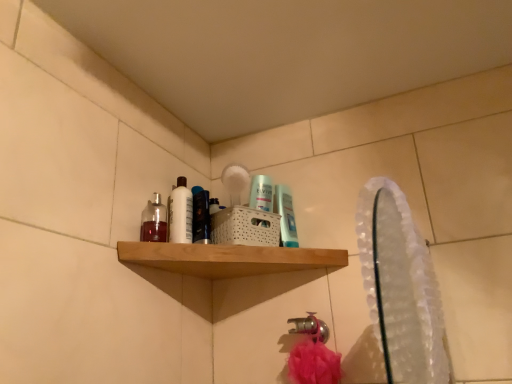
Question: Should I look upward or downward to see white glossy bottle at upper left?

Choices:
 (A) up
 (B) down

Answer: (B)

Question: Is translucent glass bottle at upper left, which ranks as the 1th mouthwash in left-to-right order, completely or partially outside of translucent plastic mouthwash at center, which ranks as the 2th mouthwash in left-to-right order?

Choices:
 (A) no
 (B) yes

Answer: (B)

Question: Is translucent glass bottle at upper left, which ranks as the 1th mouthwash in left-to-right order, next to translucent plastic mouthwash at center, which ranks as the 2th mouthwash in left-to-right order?

Choices:
 (A) no
 (B) yes

Answer: (A)

Question: Considering the relative positions of translucent glass bottle at upper left, which is the third mouthwash in right-to-left order, and translucent plastic mouthwash at center, which ranks as the 2th mouthwash in left-to-right order, in the image provided, is translucent glass bottle at upper left, which is the third mouthwash in right-to-left order, to the right of translucent plastic mouthwash at center, which ranks as the 2th mouthwash in left-to-right order, from the viewer's perspective?

Choices:
 (A) yes
 (B) no

Answer: (B)

Question: Considering the relative sizes of translucent glass bottle at upper left, which ranks as the 1th mouthwash in left-to-right order, and translucent plastic mouthwash at center, the 2th mouthwash positioned from the right, in the image provided, is translucent glass bottle at upper left, which ranks as the 1th mouthwash in left-to-right order, taller than translucent plastic mouthwash at center, the 2th mouthwash positioned from the right,?

Choices:
 (A) no
 (B) yes

Answer: (A)

Question: Could translucent plastic mouthwash at center, which ranks as the 2th mouthwash in left-to-right order, be considered to be inside translucent glass bottle at upper left, which is the third mouthwash in right-to-left order?

Choices:
 (A) yes
 (B) no

Answer: (B)

Question: Is the position of translucent glass bottle at upper left, which ranks as the 1th mouthwash in left-to-right order, less distant than that of translucent plastic mouthwash at center, which ranks as the 2th mouthwash in left-to-right order?

Choices:
 (A) yes
 (B) no

Answer: (A)

Question: Does clear plastic mirror at upper right have a larger size compared to translucent plastic mouthwash at upper center, acting as the first mouthwash starting from the right?

Choices:
 (A) no
 (B) yes

Answer: (B)

Question: From the image's perspective, does clear plastic mirror at upper right appear lower than translucent plastic mouthwash at upper center, which ranks as the 3th mouthwash in left-to-right order?

Choices:
 (A) no
 (B) yes

Answer: (B)

Question: Would you say clear plastic mirror at upper right is a long distance from translucent plastic mouthwash at upper center, acting as the first mouthwash starting from the right?

Choices:
 (A) no
 (B) yes

Answer: (A)

Question: Is clear plastic mirror at upper right positioned with its back to translucent plastic mouthwash at upper center, which ranks as the 3th mouthwash in left-to-right order?

Choices:
 (A) no
 (B) yes

Answer: (A)

Question: Is clear plastic mirror at upper right positioned beyond the bounds of translucent plastic mouthwash at upper center, acting as the first mouthwash starting from the right?

Choices:
 (A) yes
 (B) no

Answer: (A)

Question: Considering the relative positions of clear plastic mirror at upper right and translucent plastic mouthwash at upper center, which ranks as the 3th mouthwash in left-to-right order, in the image provided, is clear plastic mirror at upper right to the right of translucent plastic mouthwash at upper center, which ranks as the 3th mouthwash in left-to-right order, from the viewer's perspective?

Choices:
 (A) no
 (B) yes

Answer: (B)

Question: Does clear plastic mirror at upper right have a larger size compared to translucent plastic mouthwash at center, the 2th mouthwash positioned from the right?

Choices:
 (A) no
 (B) yes

Answer: (B)